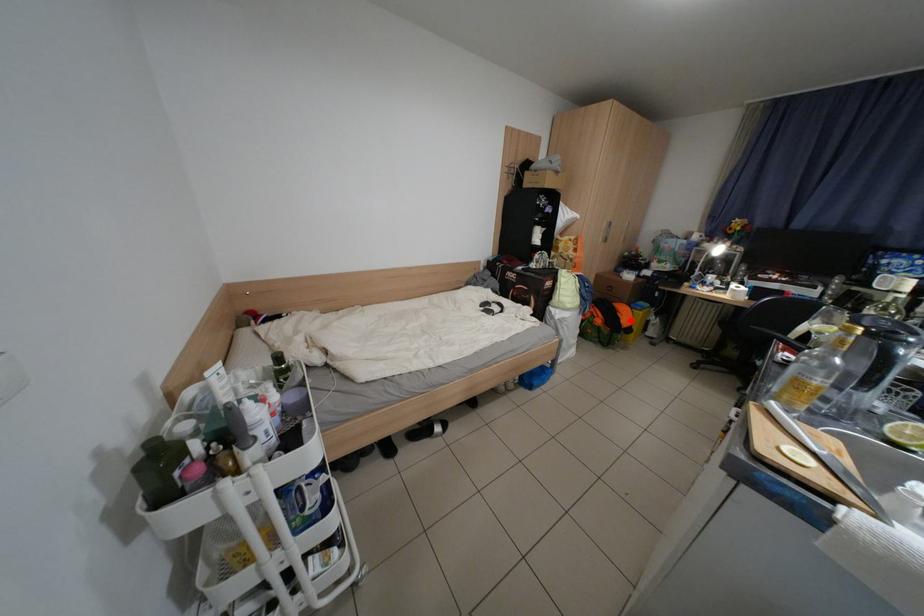
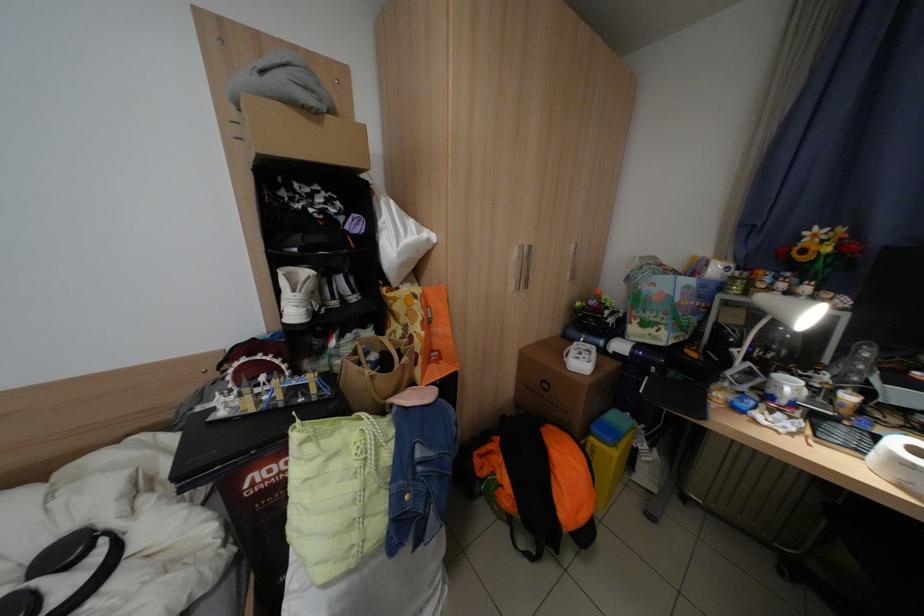
Question: I am providing you with two images of the same scene from different viewpoints. In image1, a red point is highlighted. Considering the same 3D point in image2, which of the following is correct?

Choices:
 (A) It is closer
 (B) It is farther

Answer: (B)